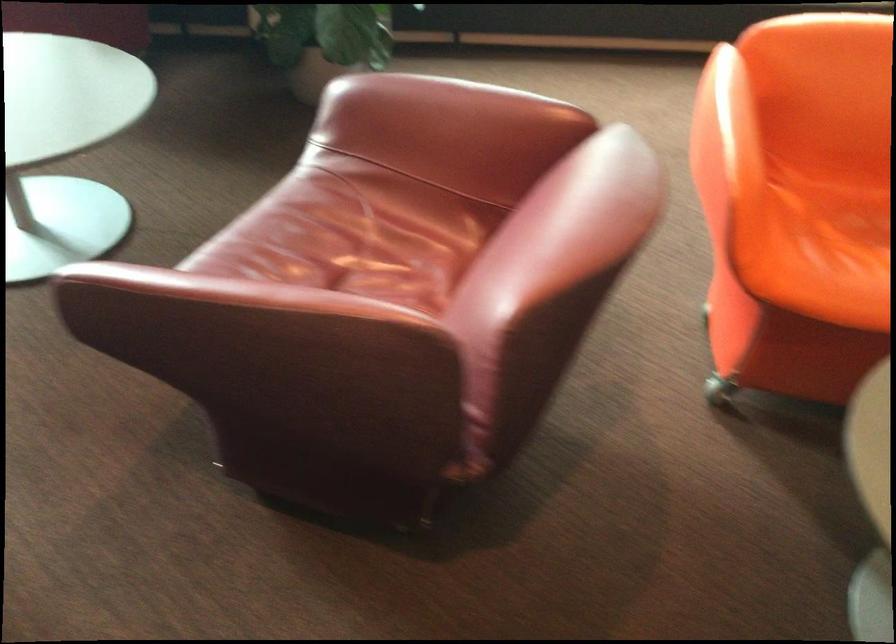
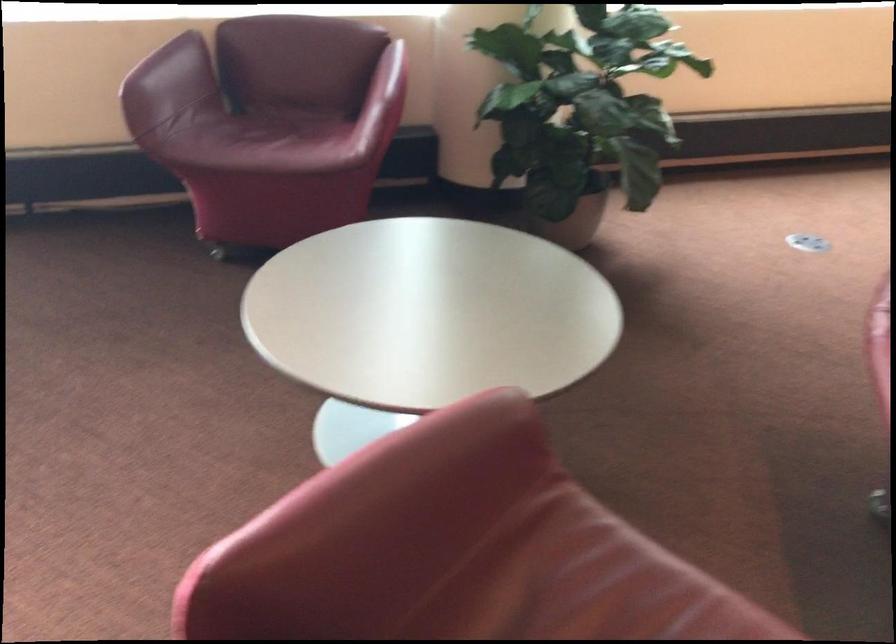
Where in the second image is the point corresponding to (298,77) from the first image?

(573, 223)